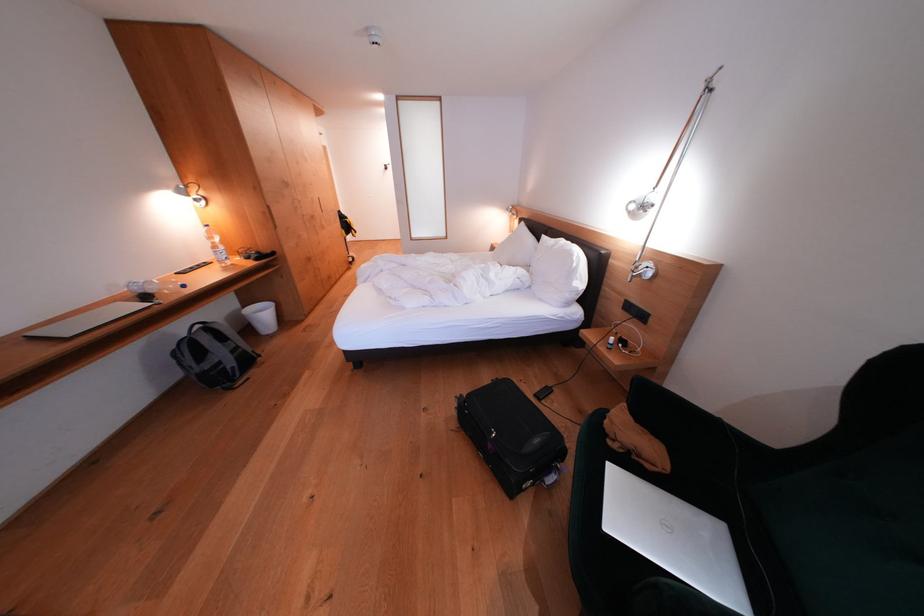
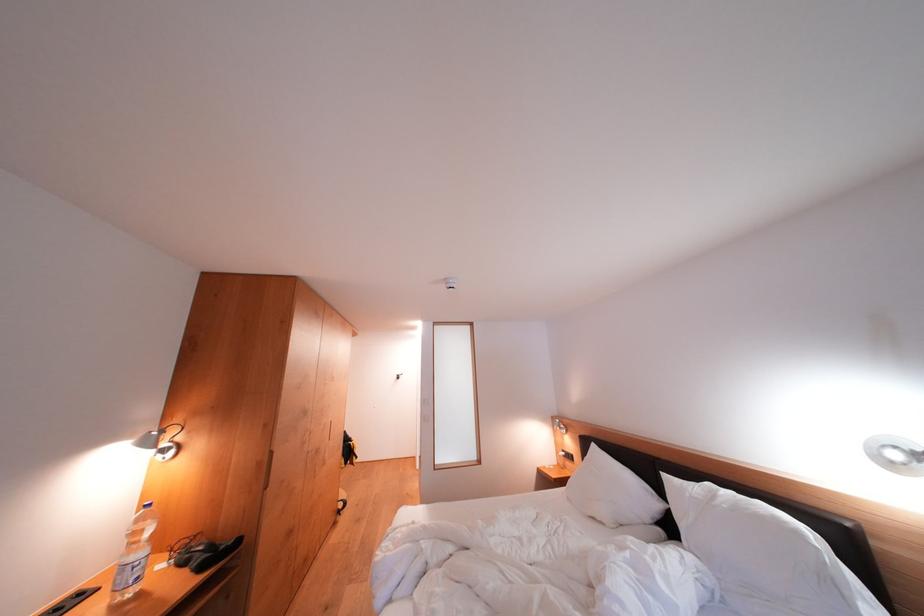
The point at (216, 241) is marked in the first image. Where is the corresponding point in the second image?

(141, 537)